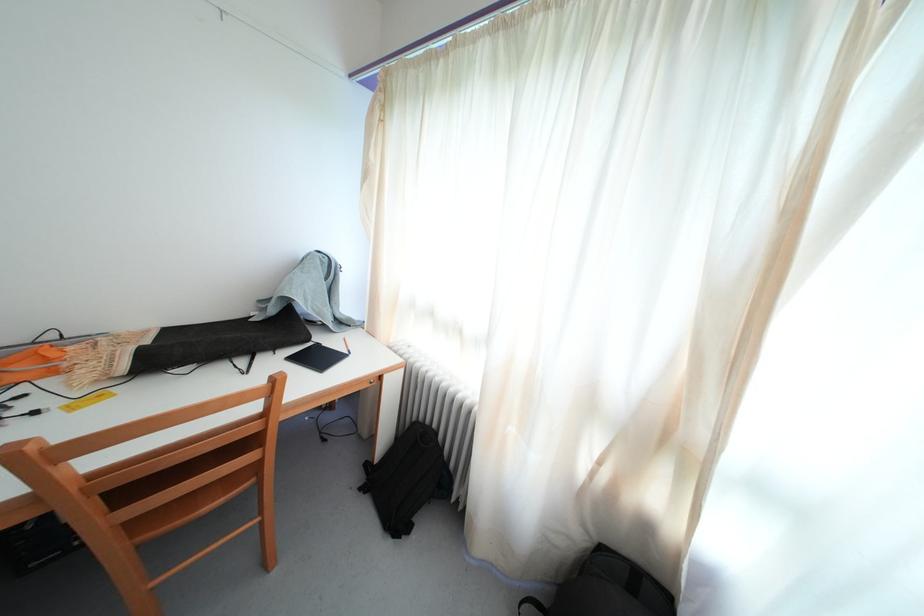
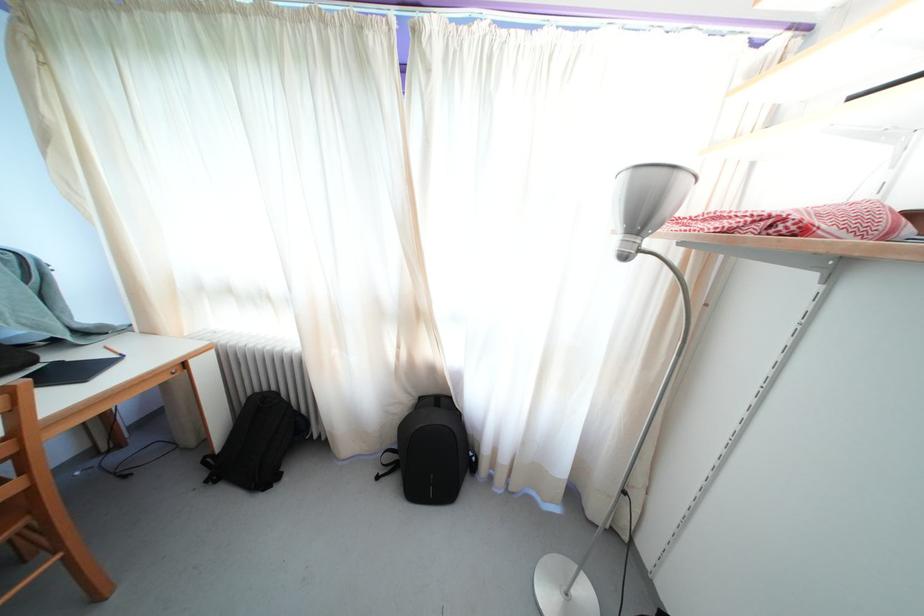
Where in the second image is the point corresponding to (x=608, y=553) from the first image?

(427, 405)